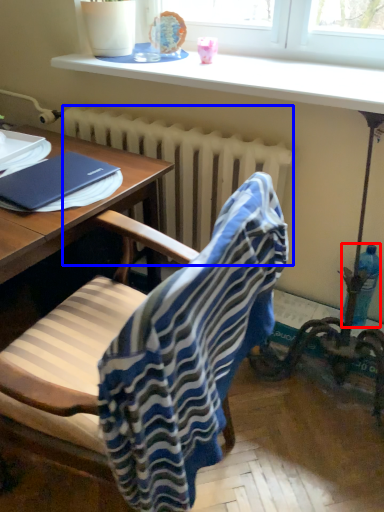
Question: Which of the following is the farthest to the observer, bottle (highlighted by a red box) or radiator (highlighted by a blue box)?

Choices:
 (A) bottle
 (B) radiator

Answer: (A)